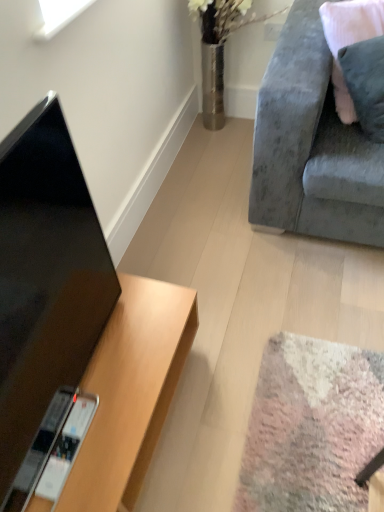
Find the location of `vacant space situated on the left part of velvet grey couch at upper right`. vacant space situated on the left part of velvet grey couch at upper right is located at coordinates (204, 204).